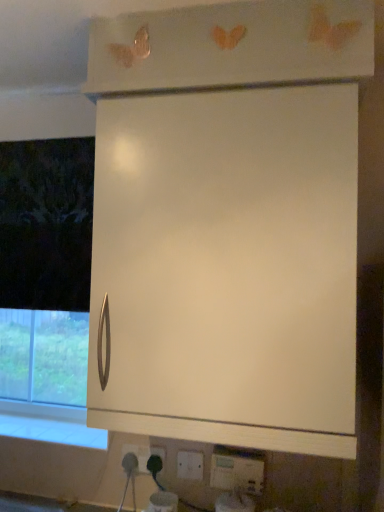
Question: Which direction should I rotate to face white plastic electric outlet at lower center, which appears as the 2th electric outlet when viewed from the back, — up or down?

Choices:
 (A) down
 (B) up

Answer: (A)

Question: From a real-world perspective, is white plastic electric outlet at lower center, the second electric outlet when ordered from front to back, physically below white glossy window sill at lower left?

Choices:
 (A) no
 (B) yes

Answer: (B)

Question: Can you confirm if white plastic electric outlet at lower center, which ranks as the 2th electric outlet in right-to-left order, is taller than white glossy window sill at lower left?

Choices:
 (A) yes
 (B) no

Answer: (A)

Question: Could white glossy window sill at lower left be considered to be inside white plastic electric outlet at lower center, which appears as the 2th electric outlet when viewed from the back?

Choices:
 (A) no
 (B) yes

Answer: (A)

Question: Could you tell me if white plastic electric outlet at lower center, marked as the second electric outlet in a left-to-right arrangement, is facing white glossy window sill at lower left?

Choices:
 (A) yes
 (B) no

Answer: (B)

Question: Is white plastic electric outlet at lower center, which appears as the 2th electric outlet when viewed from the back, further to the viewer compared to white glossy window sill at lower left?

Choices:
 (A) no
 (B) yes

Answer: (A)

Question: From the image's perspective, is white plastic electric outlet at lower center, marked as the second electric outlet in a left-to-right arrangement, over white glossy window sill at lower left?

Choices:
 (A) no
 (B) yes

Answer: (A)

Question: From a real-world perspective, is white plastic socket at lower center, arranged as the first electric outlet when viewed from the left, below white glossy window sill at lower left?

Choices:
 (A) yes
 (B) no

Answer: (A)

Question: Is white plastic socket at lower center, arranged as the first electric outlet when viewed from the left, positioned in front of white glossy window sill at lower left?

Choices:
 (A) no
 (B) yes

Answer: (B)

Question: Is white plastic socket at lower center, arranged as the first electric outlet when viewed from the left, looking in the opposite direction of white glossy window sill at lower left?

Choices:
 (A) yes
 (B) no

Answer: (B)

Question: Is white plastic socket at lower center, arranged as the first electric outlet when viewed from the left, to the right of white glossy window sill at lower left from the viewer's perspective?

Choices:
 (A) no
 (B) yes

Answer: (B)

Question: Is white plastic socket at lower center, the third electric outlet positioned from the right, aimed at white glossy window sill at lower left?

Choices:
 (A) no
 (B) yes

Answer: (A)

Question: Is white plastic socket at lower center, marked as the third electric outlet in a front-to-back arrangement, positioned beyond the bounds of white glossy window sill at lower left?

Choices:
 (A) yes
 (B) no

Answer: (A)

Question: Is white plastic electric outlet at lower center, the second electric outlet when ordered from front to back, taller than white matte cabinet at center?

Choices:
 (A) no
 (B) yes

Answer: (A)